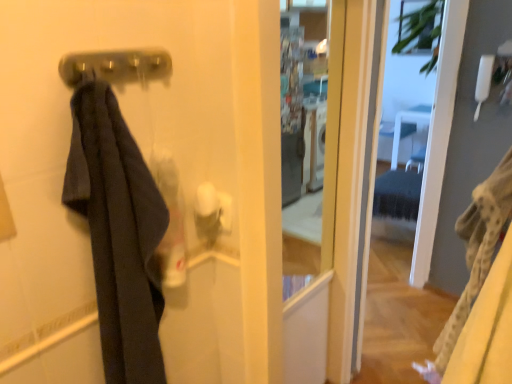
Question: From a real-world perspective, relative to transparent glass screen door at center, is dark fabric towel at left vertically above or below?

Choices:
 (A) below
 (B) above

Answer: (B)

Question: Visually, is dark fabric towel at left positioned to the left or to the right of transparent glass screen door at center?

Choices:
 (A) right
 (B) left

Answer: (B)

Question: Estimate the real-world distances between objects in this image. Which object is farther from the transparent glass screen door at center?

Choices:
 (A) metallic silver door handle at upper center
 (B) dark fabric towel at left

Answer: (A)

Question: Estimate the real-world distances between objects in this image. Which object is closer to the transparent glass screen door at center?

Choices:
 (A) metallic silver door handle at upper center
 (B) dark fabric towel at left

Answer: (B)